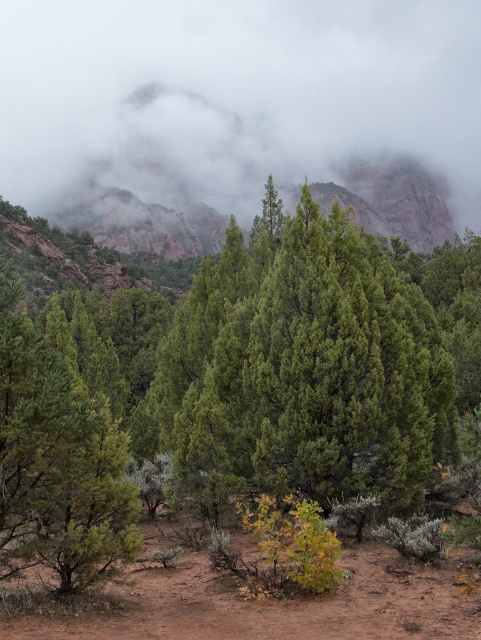
Which is in front, point (368, 122) or point (4, 276)?

Point (4, 276) is more forward.

Is foggy misty cloud at upper center thinner than green textured tree at left?

No, foggy misty cloud at upper center is not thinner than green textured tree at left.

Is point (74, 49) less distant than point (88, 460)?

No, it is behind (88, 460).

This screenshot has height=640, width=481. What are the coordinates of `foggy misty cloud at upper center` in the screenshot? It's located at (235, 97).

Does point (227, 236) come closer to viewer compared to point (112, 147)?

Yes, point (227, 236) is in front of point (112, 147).

The width and height of the screenshot is (481, 640). Find the location of `green needle-like trees at center`. green needle-like trees at center is located at coordinates (228, 380).

The width and height of the screenshot is (481, 640). Find the location of `green needle-like trees at center`. green needle-like trees at center is located at coordinates (228, 380).

Is green needle-like trees at center bigger than green textured tree at left?

Correct, green needle-like trees at center is larger in size than green textured tree at left.

Is green needle-like trees at center smaller than green textured tree at left?

Incorrect, green needle-like trees at center is not smaller in size than green textured tree at left.

The width and height of the screenshot is (481, 640). I want to click on green needle-like trees at center, so click(x=228, y=380).

Where is `green needle-like trees at center`? green needle-like trees at center is located at coordinates (228, 380).